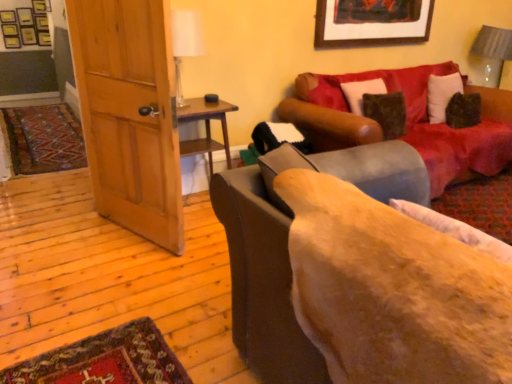
Question: Considering the positions of velvet red couch at upper right, acting as the first studio couch starting from the back, and gray fabric lampshade at upper right in the image, is velvet red couch at upper right, acting as the first studio couch starting from the back, bigger or smaller than gray fabric lampshade at upper right?

Choices:
 (A) big
 (B) small

Answer: (A)

Question: From a real-world perspective, relative to gray fabric lampshade at upper right, is velvet red couch at upper right, acting as the first studio couch starting from the back, vertically above or below?

Choices:
 (A) above
 (B) below

Answer: (B)

Question: Which object is positioned closest to the wooden door at left?

Choices:
 (A) wooden side table at left
 (B) wooden picture frame at upper center
 (C) velvet brown couch at center, the 2th studio couch viewed from the back
 (D) gray fabric lampshade at upper right
 (E) white glass table lamp at upper center

Answer: (A)

Question: Which of these objects is positioned closest to the wooden picture frame at upper center?

Choices:
 (A) white glass table lamp at upper center
 (B) wooden door at left
 (C) velvet red couch at upper right, acting as the first studio couch starting from the back
 (D) fluffy beige pillow at lower right
 (E) wooden side table at left

Answer: (C)